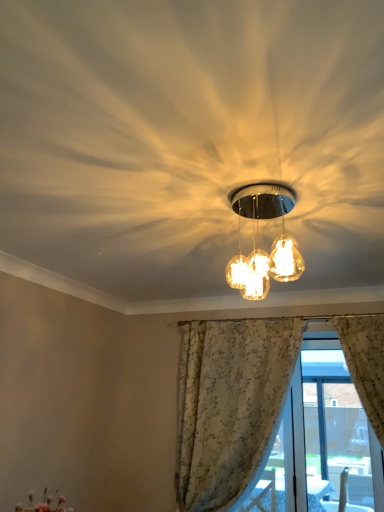
Question: From the image's perspective, relative to matte glass globe at center, is white floral curtain at lower right above or below?

Choices:
 (A) above
 (B) below

Answer: (B)

Question: Is white floral curtain at lower right bigger or smaller than matte glass globe at center?

Choices:
 (A) small
 (B) big

Answer: (B)

Question: Which of these objects is positioned closest to the white lace curtain at center?

Choices:
 (A) matte glass globe at center
 (B) white floral curtain at lower right

Answer: (B)

Question: Considering the real-world distances, which object is closest to the white floral curtain at lower right?

Choices:
 (A) matte glass globe at center
 (B) white lace curtain at center

Answer: (B)